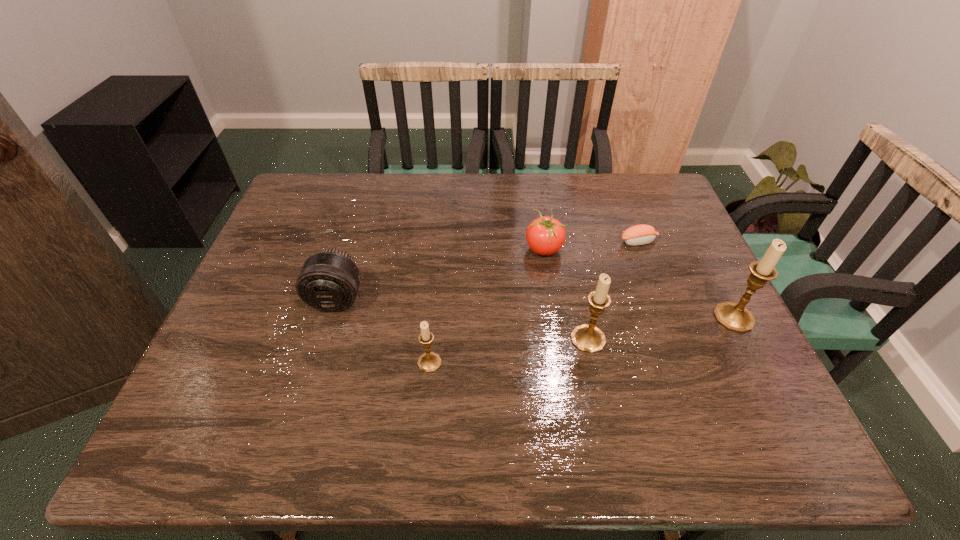
Locate an element on the screen. This screenshot has width=960, height=540. free space between the fifth tallest object and the shortest object is located at coordinates (591, 245).

Where is `free space between the fifth object from right to left and the second candle holder from right to left`? This screenshot has width=960, height=540. free space between the fifth object from right to left and the second candle holder from right to left is located at coordinates (509, 351).

Find the location of a particular element. vacant area between the shortest candle holder and the second shortest object is located at coordinates (487, 306).

Point out which object is positioned as the second nearest to the fifth shortest object. Please provide its 2D coordinates. Your answer should be formatted as a tuple, i.e. [(x, y)], where the tuple contains the x and y coordinates of a point satisfying the conditions above.

[(735, 317)]

The image size is (960, 540). Identify the location of object that stands as the third closest to the shortest object. (587, 338).

Choose which candle holder is the second nearest neighbor to the shortest candle holder. Please provide its 2D coordinates. Your answer should be formatted as a tuple, i.e. [(x, y)], where the tuple contains the x and y coordinates of a point satisfying the conditions above.

[(735, 317)]

Identify which candle holder is located as the second nearest to the tomato. Please provide its 2D coordinates. Your answer should be formatted as a tuple, i.e. [(x, y)], where the tuple contains the x and y coordinates of a point satisfying the conditions above.

[(429, 362)]

Find the location of `vacant space that satisfies the following two spatial constraints: 1. on the front side of the rightmost candle holder; 2. on the right side of the shortest object`. vacant space that satisfies the following two spatial constraints: 1. on the front side of the rightmost candle holder; 2. on the right side of the shortest object is located at coordinates coord(667,318).